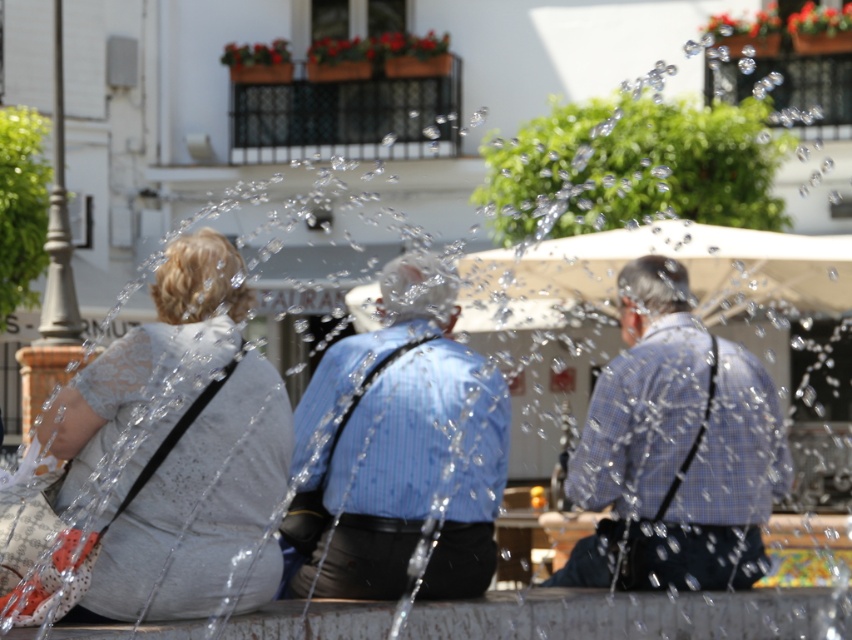
Is blue striped shirt at center behind blue checkered shirt at center?

No, it is not.

Does blue striped shirt at center have a lesser height compared to blue checkered shirt at center?

Yes, blue striped shirt at center is shorter than blue checkered shirt at center.

In order to click on blue striped shirt at center in this screenshot , I will do `click(400, 451)`.

Does white dotted fabric at left appear on the left side of blue striped shirt at center?

Correct, you'll find white dotted fabric at left to the left of blue striped shirt at center.

The image size is (852, 640). I want to click on white dotted fabric at left, so click(x=179, y=449).

Is the position of white dotted fabric at left more distant than that of blue checkered shirt at center?

No, it is not.

Is white dotted fabric at left bigger than blue checkered shirt at center?

Incorrect, white dotted fabric at left is not larger than blue checkered shirt at center.

Locate an element on the screen. white dotted fabric at left is located at coordinates (179, 449).